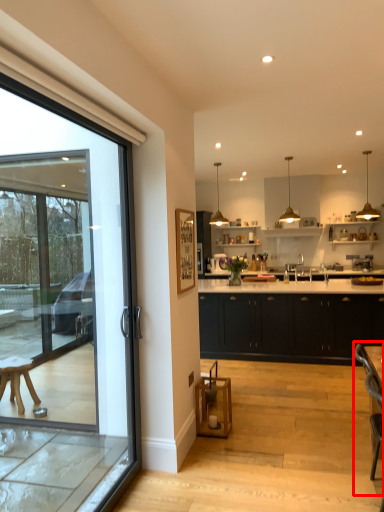
Question: From the image's perspective, where is armchair (annotated by the red box) located relative to cabinetry?

Choices:
 (A) below
 (B) above

Answer: (A)